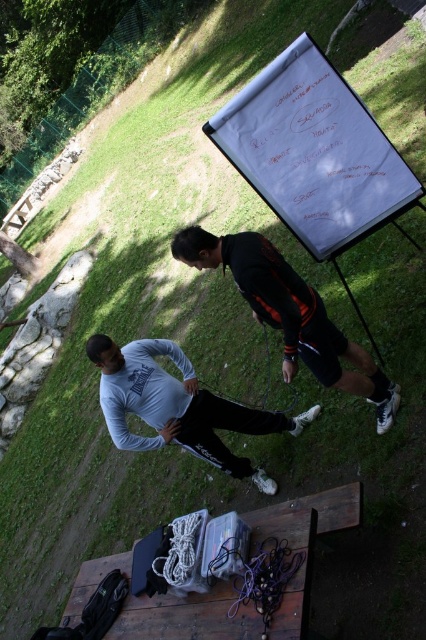
Question: Which object appears farthest from the camera in this image?

Choices:
 (A) white matte shirt at lower left
 (B) black matte jacket at center
 (C) wooden picnic table at lower center

Answer: (A)

Question: Which point is closer to the camera taking this photo?

Choices:
 (A) (291, 276)
 (B) (129, 388)
 (C) (305, 508)

Answer: (C)

Question: Does white matte shirt at lower left appear over black matte jacket at center?

Choices:
 (A) no
 (B) yes

Answer: (A)

Question: Is white matte shirt at lower left smaller than black matte jacket at center?

Choices:
 (A) no
 (B) yes

Answer: (B)

Question: Where is white matte shirt at lower left located in relation to black matte jacket at center in the image?

Choices:
 (A) below
 (B) above

Answer: (A)

Question: Among these objects, which one is farthest from the camera?

Choices:
 (A) black matte jacket at center
 (B) white matte shirt at lower left
 (C) wooden picnic table at lower center

Answer: (B)